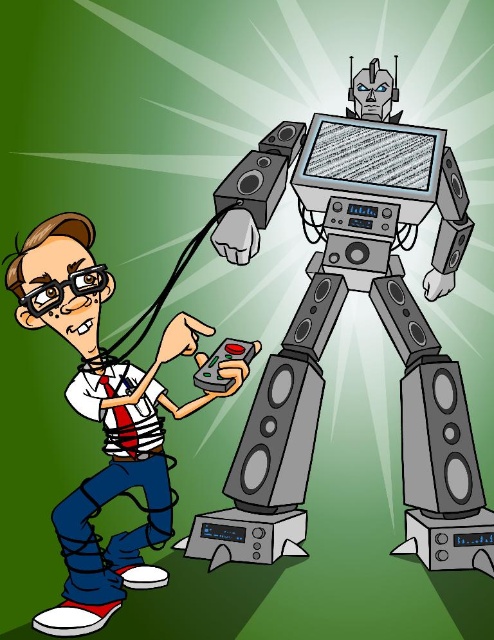
You are a delivery person who needs to place both the satin black speaker at center and the metallic gray speaker at lower right into a box. The box can only accommodate items that are no taller than the shorter speaker. Which speaker should you use as the height reference to ensure both fit?

The metallic gray speaker at lower right is shorter than the satin black speaker at center, so you should use the metallic gray speaker at lower right as the height reference to ensure both fit in the box.